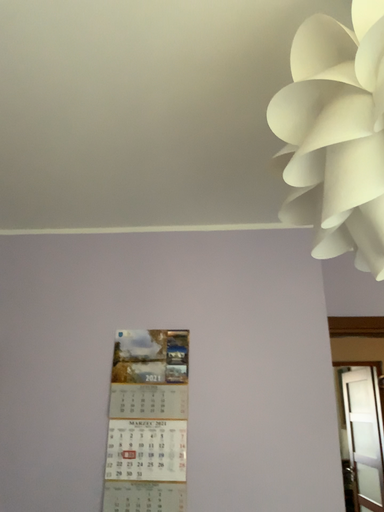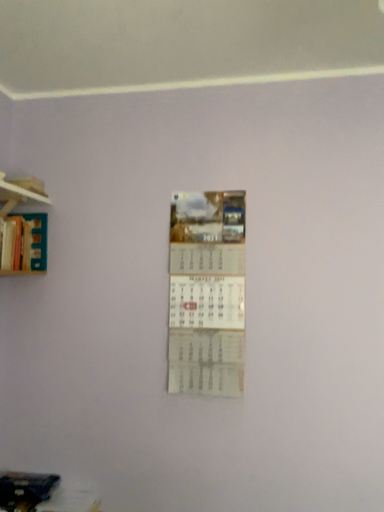
Question: Which way did the camera rotate in the video?

Choices:
 (A) rotated upward
 (B) rotated downward

Answer: (B)